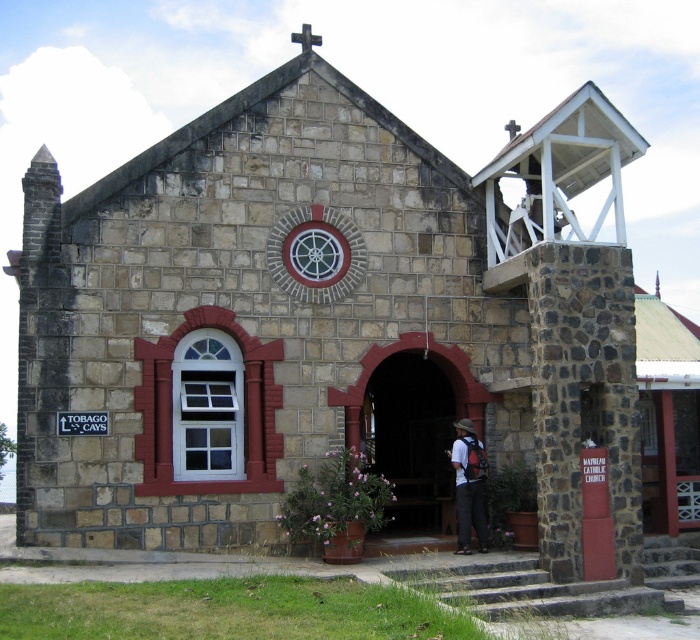
Which is behind, point (469, 477) or point (312, 42)?

The point (312, 42) is behind.

Does matte black backpack at lower center have a smaller size compared to black stone cross at upper center?

Correct, matte black backpack at lower center occupies less space than black stone cross at upper center.

Between point (455, 493) and point (304, 45), which one is positioned behind?

The point (455, 493) is behind.

The width and height of the screenshot is (700, 640). I want to click on matte black backpack at lower center, so click(x=468, y=488).